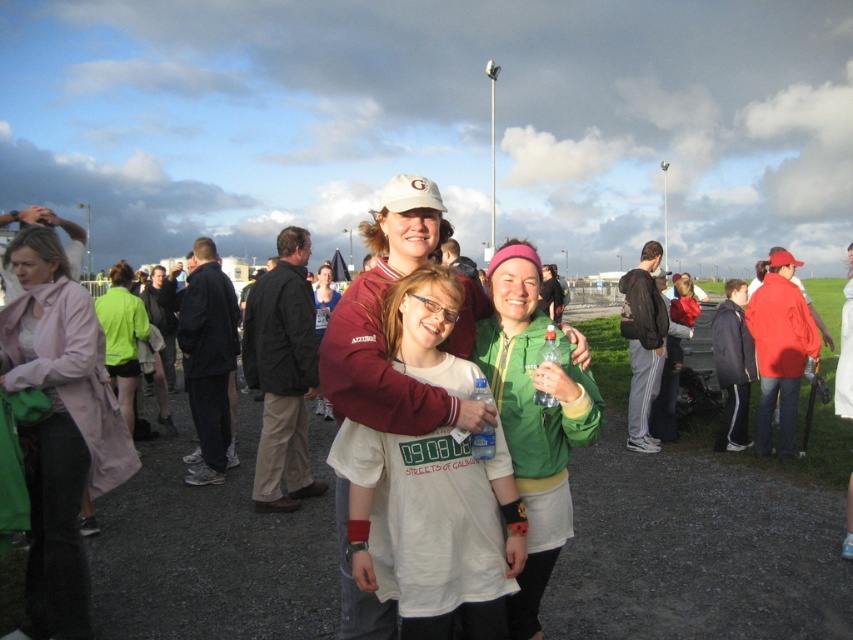
Between white cotton t-shirt at center and black fabric jacket at left, which one has more height?

With more height is black fabric jacket at left.

Can you confirm if white cotton t-shirt at center is taller than black fabric jacket at left?

In fact, white cotton t-shirt at center may be shorter than black fabric jacket at left.

Find the location of a particular element. The image size is (853, 640). white cotton t-shirt at center is located at coordinates (432, 534).

Identify the location of white cotton t-shirt at center. The image size is (853, 640). (432, 534).

Is pink fabric jacket at left bigger than black fabric jacket at left?

Indeed, pink fabric jacket at left has a larger size compared to black fabric jacket at left.

The image size is (853, 640). In order to click on pink fabric jacket at left in this screenshot , I will do [x=59, y=428].

Which is in front, point (78, 614) or point (300, 307)?

Point (78, 614) is in front.

Find the location of a particular element. pink fabric jacket at left is located at coordinates (59, 428).

Is point (80, 292) behind point (538, 493)?

Yes, point (80, 292) is farther from viewer.

In the scene shown: Who is higher up, pink fabric jacket at left or green matte jacket at center?

pink fabric jacket at left is higher up.

Is point (39, 353) in front of point (589, 388)?

No, (39, 353) is behind (589, 388).

At what (x,y) coordinates should I click in order to perform the action: click on pink fabric jacket at left. Please return your answer as a coordinate pair (x, y). Looking at the image, I should click on click(59, 428).